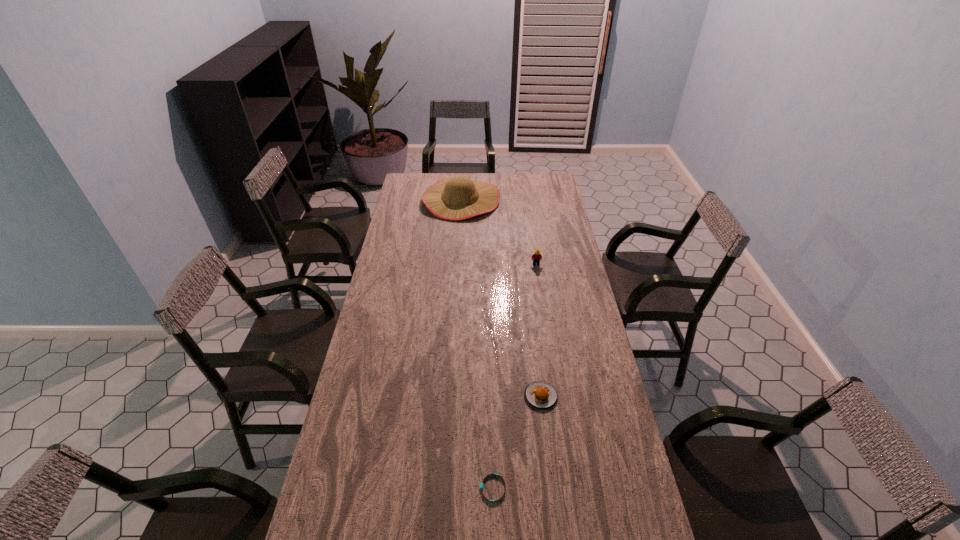
The height and width of the screenshot is (540, 960). I want to click on unoccupied area between the farthest object and the second tallest object, so click(498, 232).

This screenshot has width=960, height=540. I want to click on empty space that is in between the second tallest object and the sunhat, so click(498, 232).

The image size is (960, 540). I want to click on empty space that is in between the second tallest object and the shortest object, so click(515, 376).

Where is `unoccupied area between the third tallest object and the shortest object`? This screenshot has width=960, height=540. unoccupied area between the third tallest object and the shortest object is located at coordinates (516, 442).

What are the coordinates of `vacant region between the third farthest object and the third nearest object` in the screenshot? It's located at (539, 330).

Identify the location of free area in between the third shortest object and the sunhat. The width and height of the screenshot is (960, 540). (498, 232).

I want to click on vacant area between the third farthest object and the second farthest object, so click(539, 330).

The width and height of the screenshot is (960, 540). I want to click on free space between the wristband and the third nearest object, so pyautogui.click(x=515, y=376).

The width and height of the screenshot is (960, 540). Find the location of `vacant area that lies between the second nearest object and the wristband`. vacant area that lies between the second nearest object and the wristband is located at coordinates (516, 442).

Find the location of a particular element. vacant point located between the sunhat and the Lego is located at coordinates (498, 232).